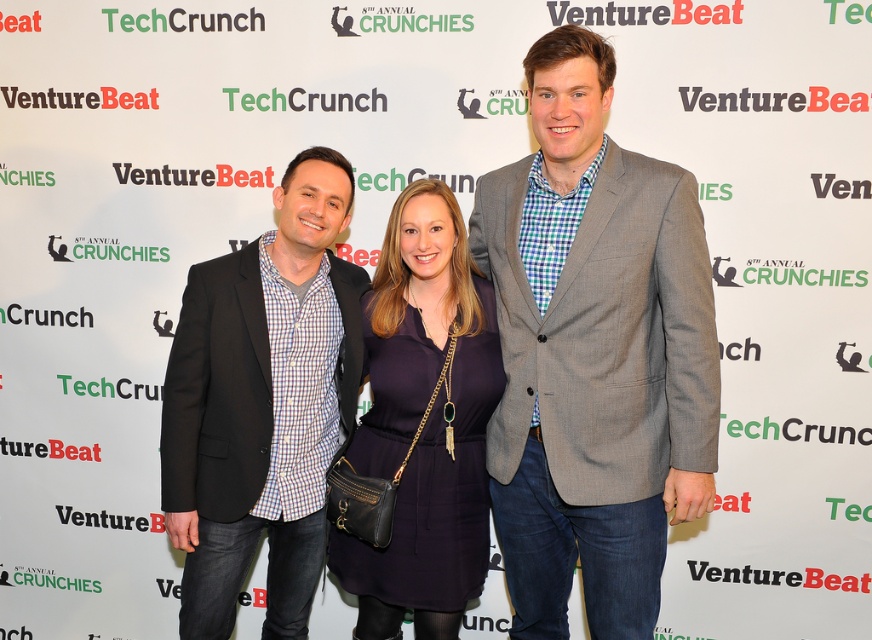
You are a photographer at the event and need to ensure that both the gray wool blazer at center and the navy matte dress at center are in focus simultaneously. The camera you are using has a depth of field that can cover 10 inches. Can you achieve this without adjusting your camera settings?

The distance between the gray wool blazer at center and the navy matte dress at center is 9.64 inches, which is within the camera depth of field of 10 inches. Therefore, you can capture both items in focus without adjusting the camera settings.

You are at the event and want to take a photo of the matte black blazer at center. Where should you position yourself to capture it best?

The matte black blazer at center is located at point [262,404], so position yourself directly in front of that coordinate to capture it best.

You are a photographer who needs to capture a clear photo of the gray wool blazer at center. You have a camera that requires a minimum distance of 1.5 meters to focus properly. Can you take the photo from your current position without moving closer?

The gray wool blazer at center and the camera are 1.72 meters apart, which is greater than the minimum required distance of 1.5 meters. Therefore, you can take the photo from your current position without moving closer.